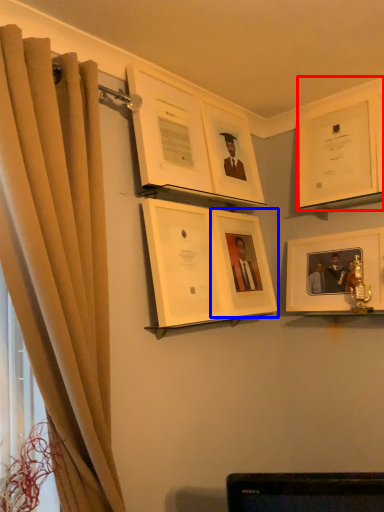
Question: Which object is closer to the camera taking this photo, picture frame (highlighted by a red box) or picture frame (highlighted by a blue box)?

Choices:
 (A) picture frame
 (B) picture frame

Answer: (B)